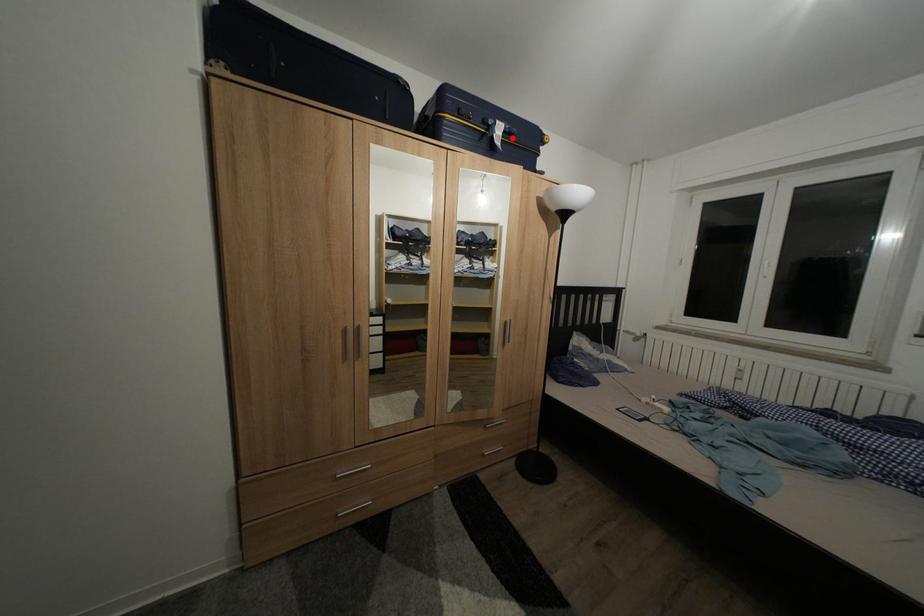
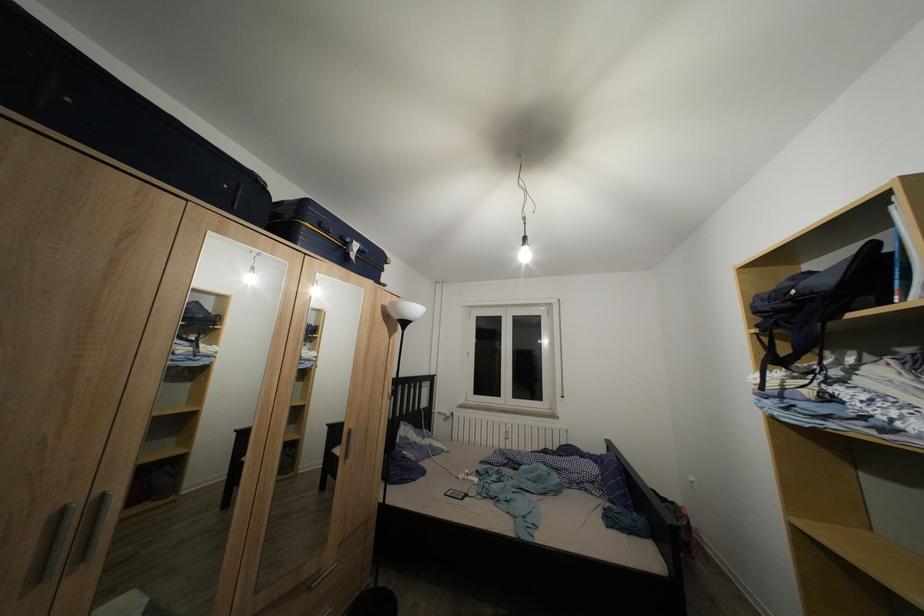
In the second image, find the point that corresponds to the highlighted location in the first image.

(367, 257)